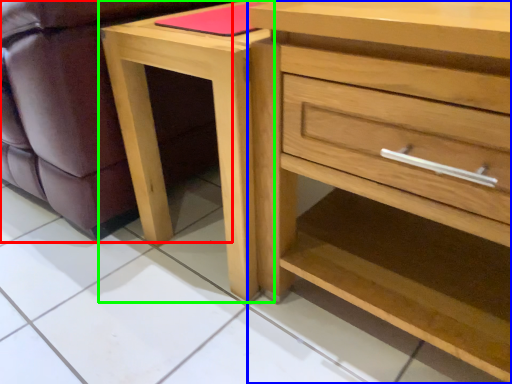
Question: Which object is positioned farthest from swivel chair (highlighted by a red box)? Select from chest of drawers (highlighted by a blue box) and nightstand (highlighted by a green box).

Choices:
 (A) chest of drawers
 (B) nightstand

Answer: (A)